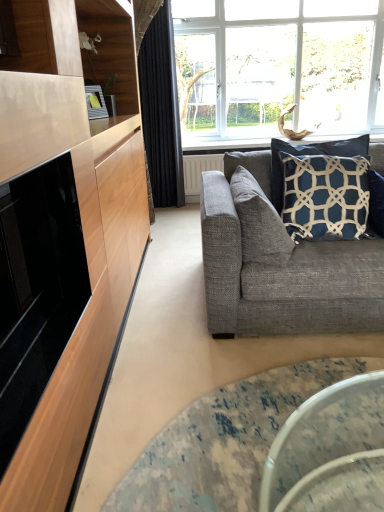
Question: From a real-world perspective, is black velvet curtain at upper center physically located above or below textured gray pillow at right, the second pillow in the right-to-left sequence?

Choices:
 (A) below
 (B) above

Answer: (B)

Question: Would you say black velvet curtain at upper center is inside or outside textured gray pillow at right, the second pillow in the right-to-left sequence?

Choices:
 (A) inside
 (B) outside

Answer: (B)

Question: Considering the real-world distances, which object is farthest from the textured gray couch at right?

Choices:
 (A) navy blue fabric pillow at upper right, the second pillow from the left
 (B) clear glass window at upper center
 (C) black velvet curtain at upper center
 (D) translucent glass coffee table at lower center
 (E) black glossy microwave at left

Answer: (B)

Question: Which object is positioned closest to the clear glass window at upper center?

Choices:
 (A) black glossy microwave at left
 (B) translucent glass coffee table at lower center
 (C) black velvet curtain at upper center
 (D) textured gray pillow at right, placed as the 1th pillow when sorted from left to right
 (E) navy blue fabric pillow at upper right, the second pillow from the left

Answer: (C)